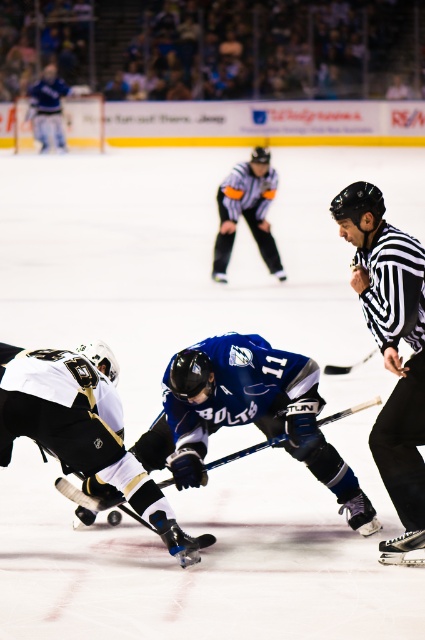
Question: Is black striped shirt at center thinner than striped jersey at center?

Choices:
 (A) no
 (B) yes

Answer: (B)

Question: Does black striped shirt at center have a smaller size compared to white jersey at center?

Choices:
 (A) no
 (B) yes

Answer: (B)

Question: Which object appears farthest from the camera in this image?

Choices:
 (A) white jersey at center
 (B) blue glossy hockey stick at center

Answer: (B)

Question: In this image, where is black striped shirt at center located relative to white jersey at center?

Choices:
 (A) above
 (B) below

Answer: (A)

Question: Which is farther from the blue glossy hockey stick at center?

Choices:
 (A) striped jersey at center
 (B) white jersey at center

Answer: (A)

Question: Among these points, which one is farthest from the camera?

Choices:
 (A) (274, 262)
 (B) (99, 376)
 (C) (212, 369)
 (D) (393, 438)

Answer: (A)